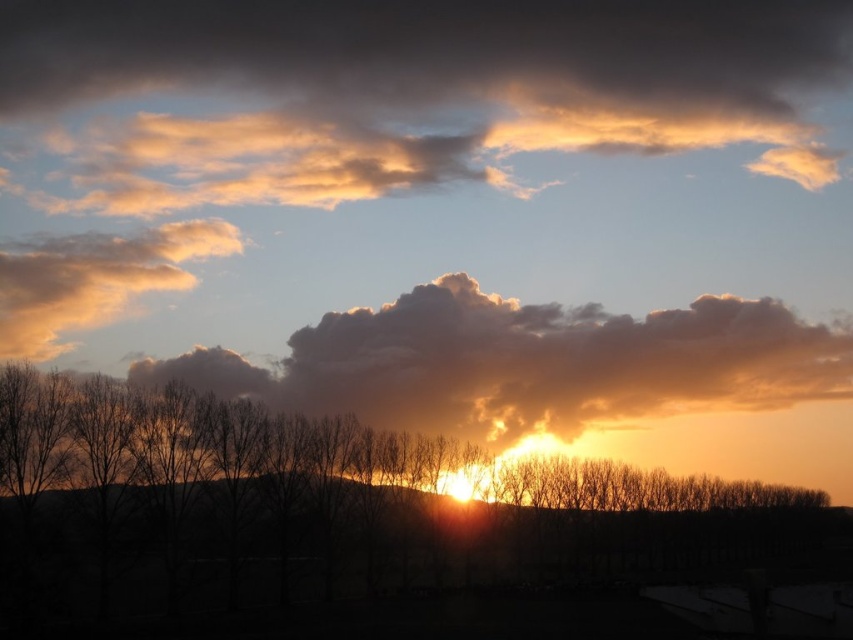
Question: Can you confirm if cloudy sky at center is wider than golden fluffy cloud at upper left?

Choices:
 (A) no
 (B) yes

Answer: (B)

Question: Which point is farther to the camera?

Choices:
 (A) (50, 259)
 (B) (664, 374)

Answer: (A)

Question: In this image, where is cloudy sky at center located relative to golden fluffy cloud at upper left?

Choices:
 (A) above
 (B) below

Answer: (B)

Question: Considering the relative positions of cloudy sky at center and golden fluffy cloud at upper left in the image provided, where is cloudy sky at center located with respect to golden fluffy cloud at upper left?

Choices:
 (A) below
 (B) above

Answer: (A)